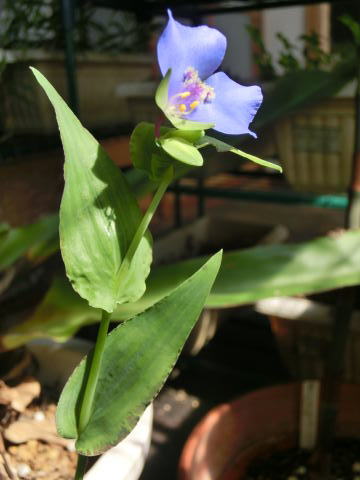
The height and width of the screenshot is (480, 360). I want to click on floor, so click(27, 200).